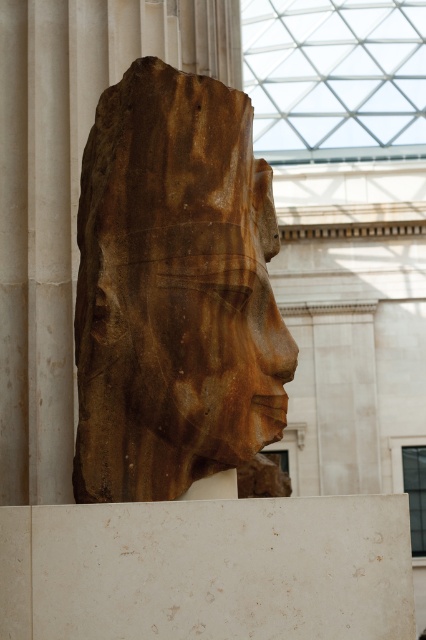
Who is taller, brown stone head at center or brown stone face at center?

With more height is brown stone head at center.

Which is behind, point (256, 216) or point (209, 323)?

The point (256, 216) is more distant.

Is point (158, 278) positioned after point (224, 353)?

Yes, it is.

At what (x,y) coordinates should I click in order to perform the action: click on brown stone head at center. Please return your answer as a coordinate pair (x, y). The width and height of the screenshot is (426, 640). Looking at the image, I should click on (173, 289).